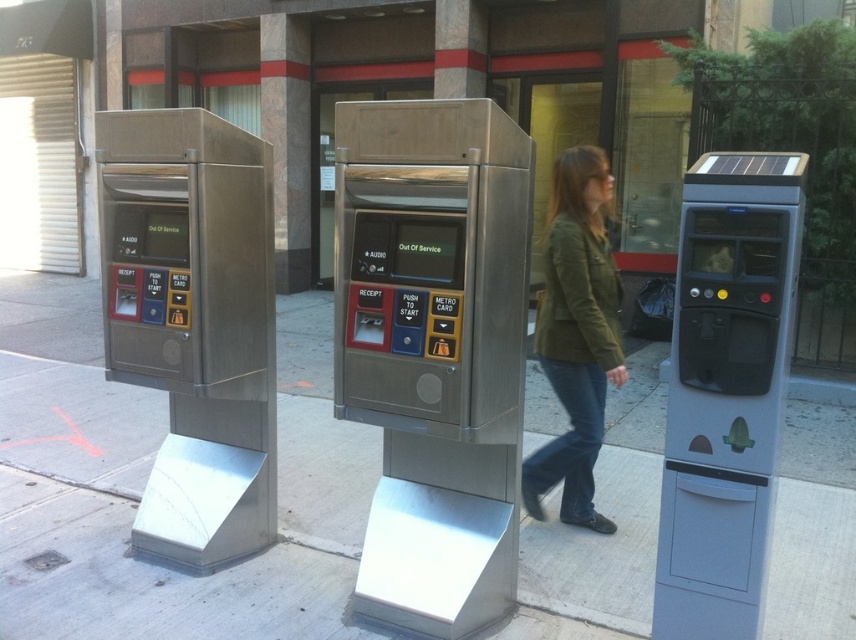
You are standing at the entrance of the building and want to reach the sidewalk. The brushed metal pavement at center is your destination. What is the coordinate of the destination?

The coordinate of the destination, which is the brushed metal pavement at center, is at point (68,388).

You are standing at the point labeled point (726, 390) in the image. What object are you at?

The point (726, 390) corresponds to the gray plastic parking meter at right.

Based on the photo, you are standing in front of the three ticket vending machines and want to reach a point that is closer to you. Which point would you choose between point (x=0, y=449) and point (x=586, y=442)?

Point (x=0, y=449) is further to the camera than point (x=586, y=442), so the closer point is point (x=586, y=442).